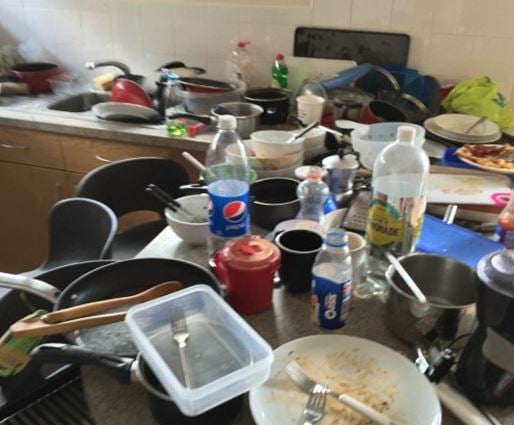
This screenshot has height=425, width=514. In order to click on counter top in this screenshot , I will do pos(299,314), pos(116,404), pos(166,245).